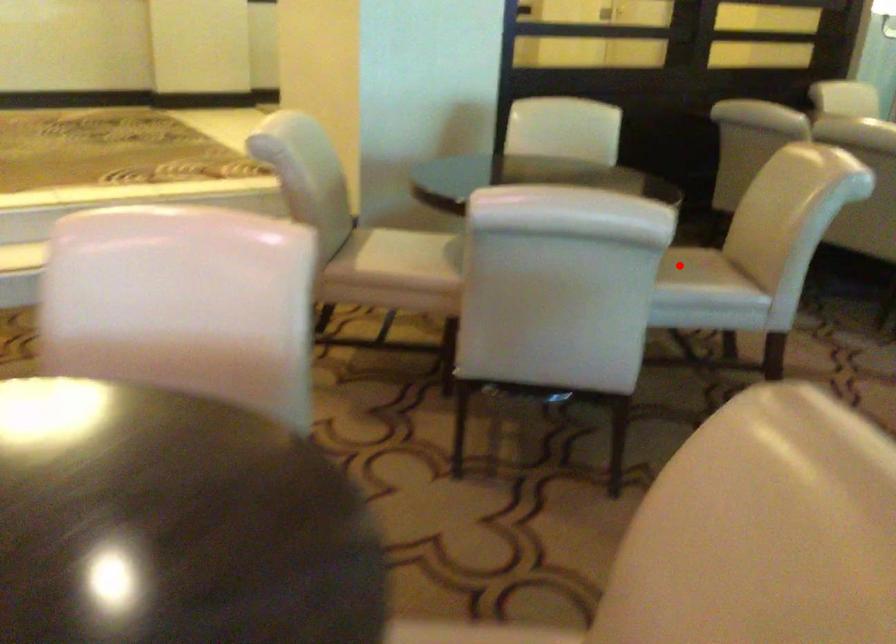
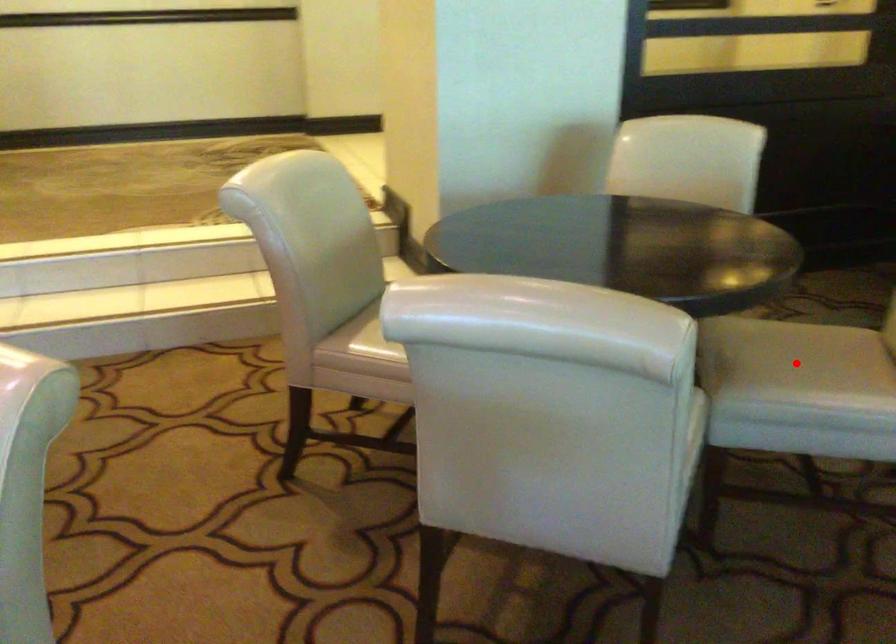
I am providing you with two images of the same scene from different viewpoints. A red point is marked on the first image and another point is marked on the second image. Is the marked point in image1 the same physical position as the marked point in image2?

Yes